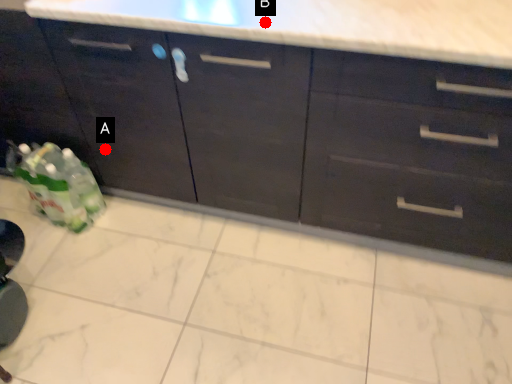
Question: Two points are circled on the image, labeled by A and B beside each circle. Which of the following is the farthest from the observer?

Choices:
 (A) A is further
 (B) B is further

Answer: (A)